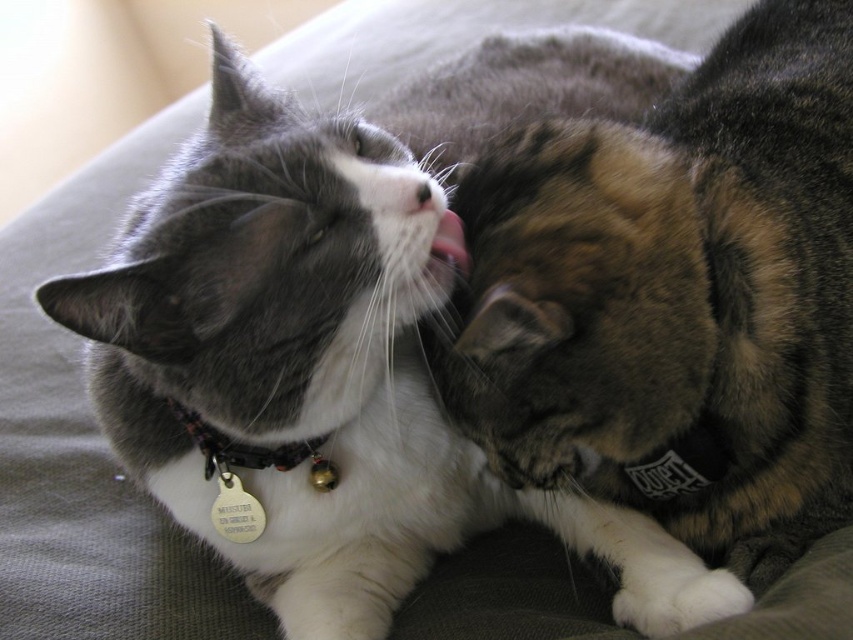
You are a veterinarian examining the cats in the image. The black fabric collar at left has a bell attached to it. If the bell were to fall straight down, would it land on the gray coat of the cat on the left or the calico coat of the cat on the right?

The black fabric collar at left is located at point (254, 451). Since the collar is on the cat on the left, the bell would fall straight down onto the gray coat of the cat on the left.

You are holding a 100 cm long measuring tape and want to measure the distance between you and the point at coordinates point [619,131]. Can you reach the point with your measuring tape?

The distance between point [619,131] and the camera is 99.85 centimeters, so yes, the measuring tape can reach the point since it is slightly shorter than 100 cm.

You are a veterinarian examining two cats in an image. You notice the tabby fur cat at center and the black fabric collar at left. Which object is taller?

The tabby fur cat at center is taller than the black fabric collar at left.